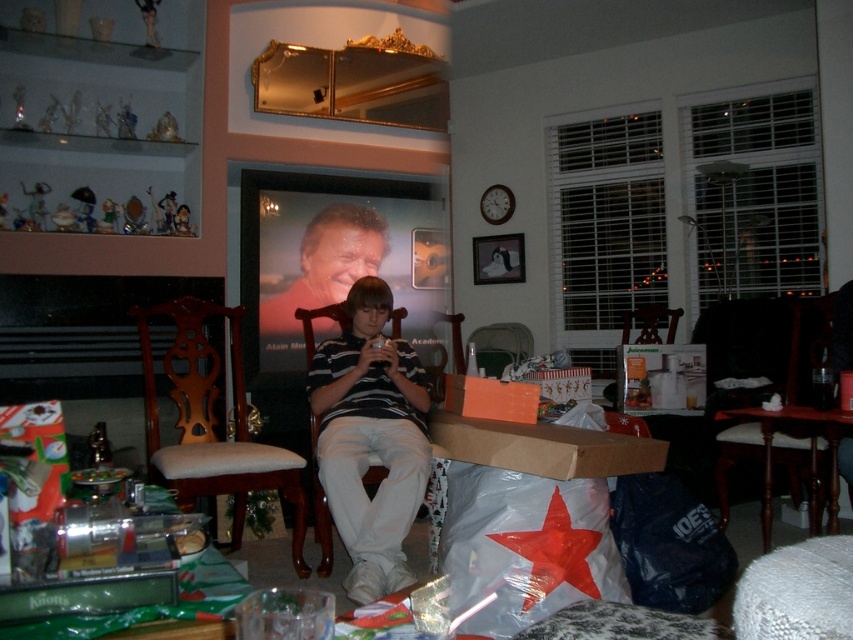
Does wooden armchair at center appear over brown cardboard box at center?

Actually, wooden armchair at center is below brown cardboard box at center.

Between wooden armchair at center and brown cardboard box at center, which one is positioned higher?

Positioned higher is brown cardboard box at center.

Does point (236, 396) lie behind point (637, 451)?

Yes, point (236, 396) is behind point (637, 451).

Where is `wooden armchair at center`? This screenshot has width=853, height=640. wooden armchair at center is located at coordinates (212, 424).

Can you confirm if striped cotton shirt at center is positioned above wooden armchair at lower right?

Actually, striped cotton shirt at center is below wooden armchair at lower right.

Is striped cotton shirt at center to the right of wooden armchair at lower right from the viewer's perspective?

No, striped cotton shirt at center is not to the right of wooden armchair at lower right.

Is point (421, 417) closer to viewer compared to point (770, 317)?

That is True.

Where is `striped cotton shirt at center`? The width and height of the screenshot is (853, 640). striped cotton shirt at center is located at coordinates (370, 438).

Can you confirm if striped cotton shirt at center is positioned to the right of wooden armchair at center?

Correct, you'll find striped cotton shirt at center to the right of wooden armchair at center.

Which is behind, point (363, 500) or point (170, 476)?

The point (363, 500) is more distant.

Locate an element on the screen. striped cotton shirt at center is located at coordinates pos(370,438).

Find the location of a particular element. This screenshot has width=853, height=640. striped cotton shirt at center is located at coordinates [x=370, y=438].